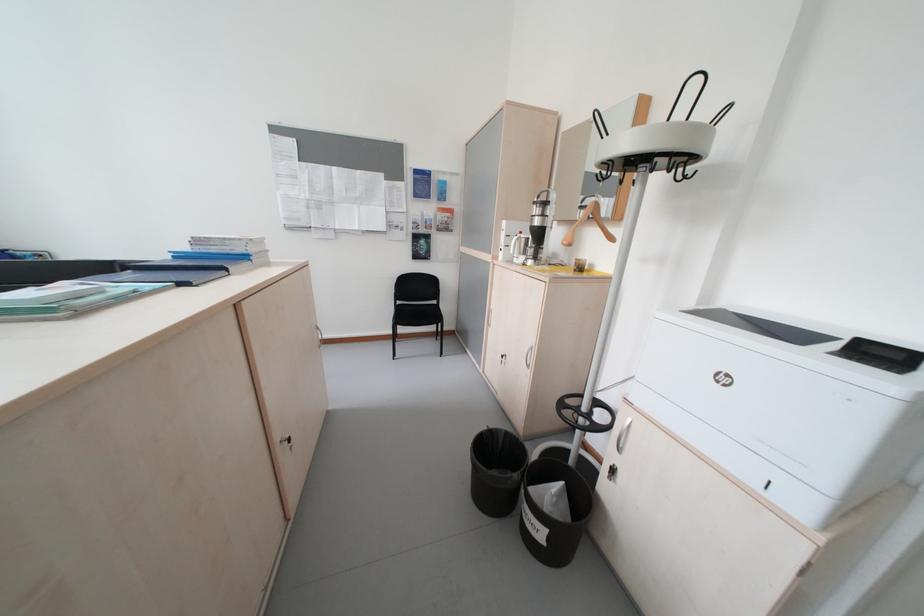
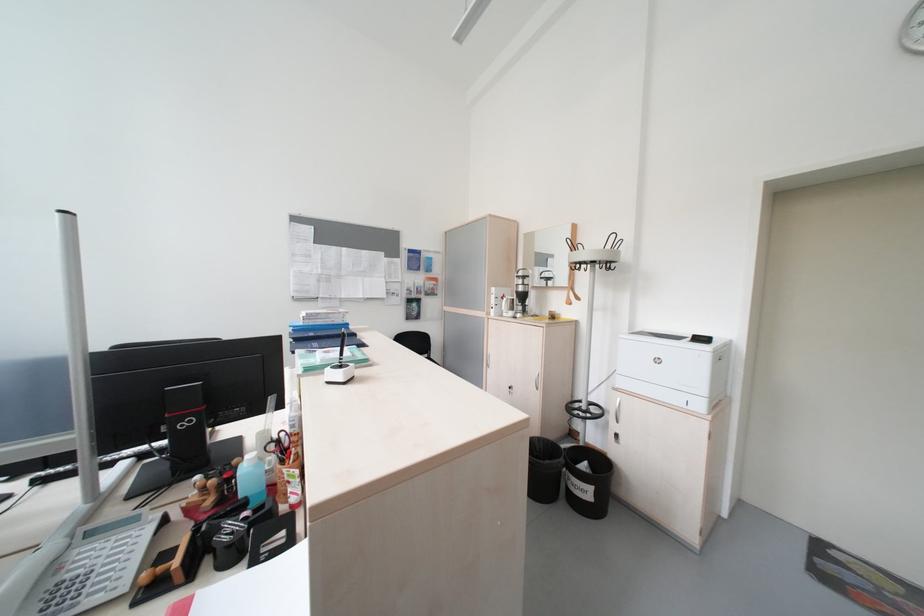
In the second image, find the point that corresponds to pixel 535 254 in the first image.

(523, 310)